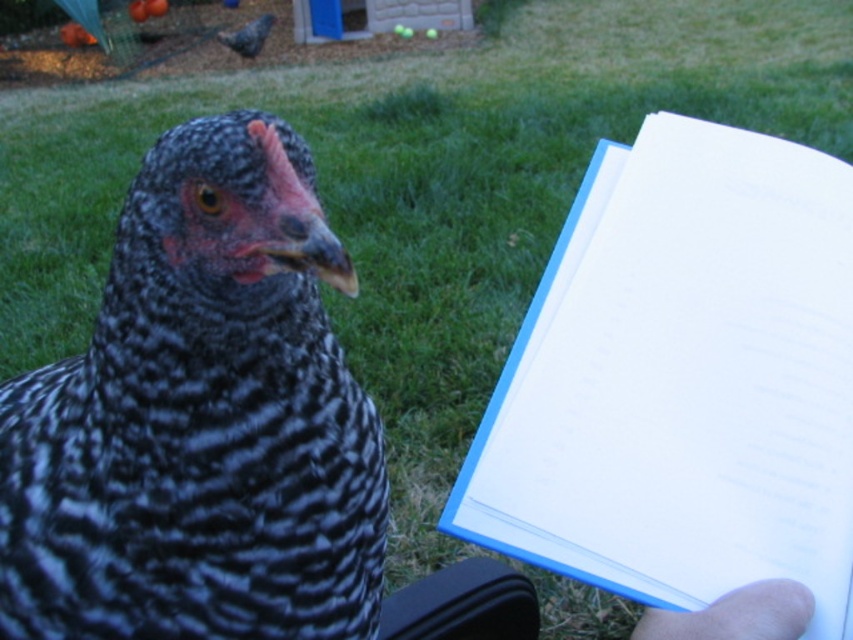
Question: From the image, what is the correct spatial relationship of white paper at right in relation to smooth skin hand at lower right?

Choices:
 (A) above
 (B) below

Answer: (A)

Question: Which object is positioned farthest from the white paper at right?

Choices:
 (A) smooth skin hand at lower right
 (B) speckled feathered chicken at center

Answer: (B)

Question: Can you confirm if white paper at right is positioned to the left of smooth skin hand at lower right?

Choices:
 (A) yes
 (B) no

Answer: (B)

Question: From the image, what is the correct spatial relationship of speckled feathered chicken at center in relation to white paper at right?

Choices:
 (A) above
 (B) below

Answer: (B)

Question: Which object is the farthest from the white paper at right?

Choices:
 (A) smooth skin hand at lower right
 (B) speckled feathered chicken at center

Answer: (B)

Question: Estimate the real-world distances between objects in this image. Which object is farther from the smooth skin hand at lower right?

Choices:
 (A) speckled feathered chicken at center
 (B) white paper at right

Answer: (A)